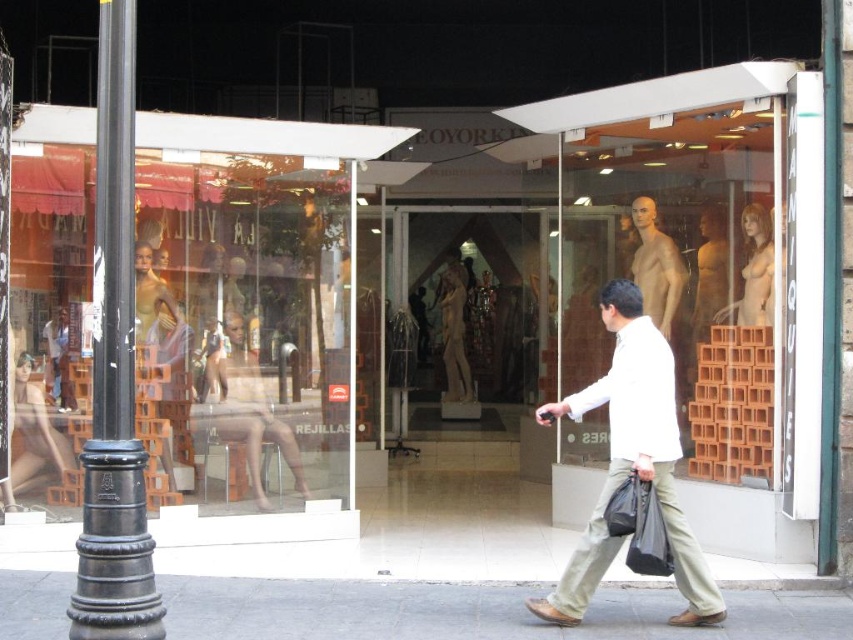
Find the location of `gray concrete sidewalk at lower center`. gray concrete sidewalk at lower center is located at coordinates (473, 611).

Does point (9, 620) lie behind point (15, 470)?

No.

You are a GUI agent. You are given a task and a screenshot of the screen. Output one action in this format:
    pyautogui.click(x=<x>, y=<y>)
    Task: Click on the gray concrete sidewalk at lower center
    The width and height of the screenshot is (853, 640).
    Given the screenshot: What is the action you would take?
    pyautogui.click(x=473, y=611)

Between gray concrete sidewalk at lower center and white matte shirt at center, which one has more height?

Standing taller between the two is white matte shirt at center.

Between gray concrete sidewalk at lower center and white matte shirt at center, which one appears on the left side from the viewer's perspective?

gray concrete sidewalk at lower center is more to the left.

Measure the distance between gray concrete sidewalk at lower center and camera.

gray concrete sidewalk at lower center and camera are 5.17 meters apart.

Where is `gray concrete sidewalk at lower center`? The image size is (853, 640). gray concrete sidewalk at lower center is located at coordinates (473, 611).

Can you confirm if clear glass mannequins at left is taller than black polished metal pole at left?

Correct, clear glass mannequins at left is much taller as black polished metal pole at left.

Can you confirm if clear glass mannequins at left is positioned to the left of black polished metal pole at left?

No, clear glass mannequins at left is not to the left of black polished metal pole at left.

Which is behind, point (26, 330) or point (120, 387)?

The point (26, 330) is more distant.

Find the location of a particular element. This screenshot has height=640, width=853. clear glass mannequins at left is located at coordinates (242, 310).